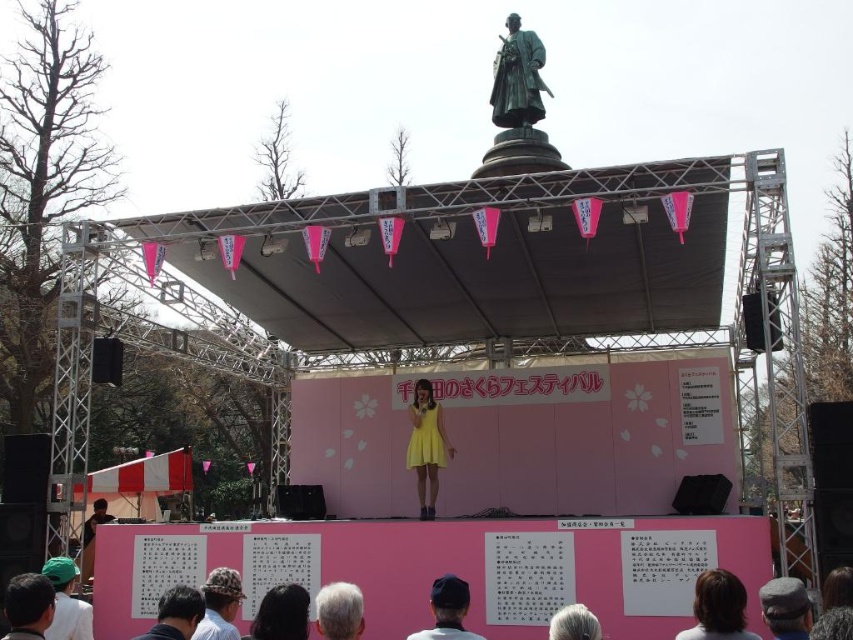
Question: Does dark hair at lower center appear on the left side of gray hair at lower center?

Choices:
 (A) yes
 (B) no

Answer: (A)

Question: Estimate the real-world distances between objects in this image. Which object is closer to the green polished bronze statue at upper center?

Choices:
 (A) dark gray fabric hat at lower center
 (B) dark blue fabric cap at lower center
 (C) yellow satin dress at center

Answer: (C)

Question: Is dark blue fabric cap at lower center bigger than gray fabric hat at lower right?

Choices:
 (A) no
 (B) yes

Answer: (B)

Question: Which point is closer to the camera taking this photo?

Choices:
 (A) (555, 632)
 (B) (514, 166)
 (C) (199, 618)
 (D) (793, 614)

Answer: (D)

Question: Can you confirm if green fabric hat at lower left is wider than gray fabric cap at lower right?

Choices:
 (A) no
 (B) yes

Answer: (A)

Question: Which point is closer to the camera taking this photo?

Choices:
 (A) (590, 637)
 (B) (408, 442)
 (C) (770, 604)

Answer: (A)